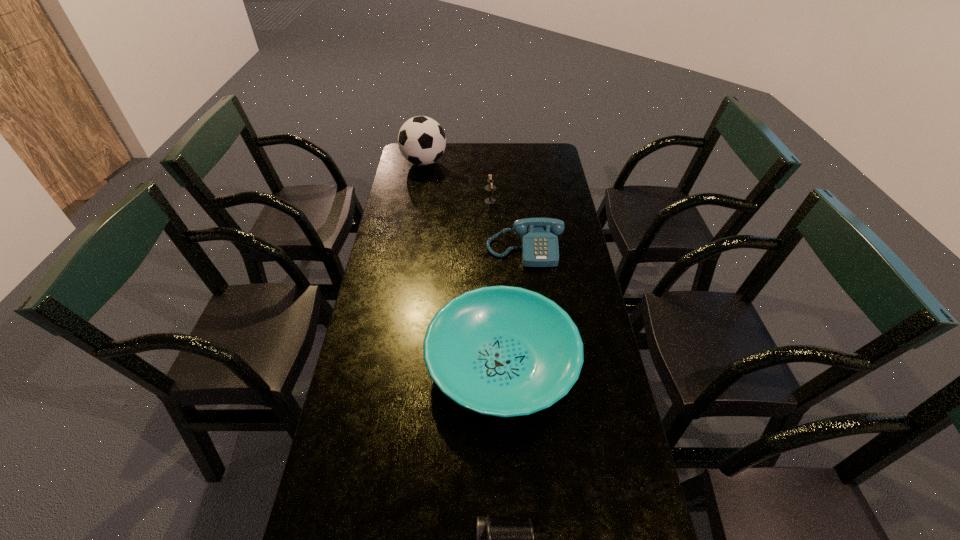
I want to click on object that is at the far edge, so click(421, 140).

Find the location of `object located in the left edge section of the desktop`. object located in the left edge section of the desktop is located at coordinates (421, 140).

Where is `telephone positioned at the right edge`? This screenshot has width=960, height=540. telephone positioned at the right edge is located at coordinates (539, 244).

The image size is (960, 540). I want to click on dish located in the right edge section of the desktop, so click(505, 351).

Where is `object present at the far left corner`? Image resolution: width=960 pixels, height=540 pixels. object present at the far left corner is located at coordinates (421, 140).

Image resolution: width=960 pixels, height=540 pixels. What are the coordinates of `free space at the far edge` in the screenshot? It's located at (518, 146).

In the image, there is a desktop. Where is `vacant region at the left edge`? This screenshot has width=960, height=540. vacant region at the left edge is located at coordinates (416, 208).

I want to click on vacant space at the right edge, so click(x=553, y=187).

Where is `empty location between the fourth farthest object and the tallest object`? empty location between the fourth farthest object and the tallest object is located at coordinates (463, 263).

Find the location of a particular element. blank region between the tallest object and the fourth nearest object is located at coordinates (457, 182).